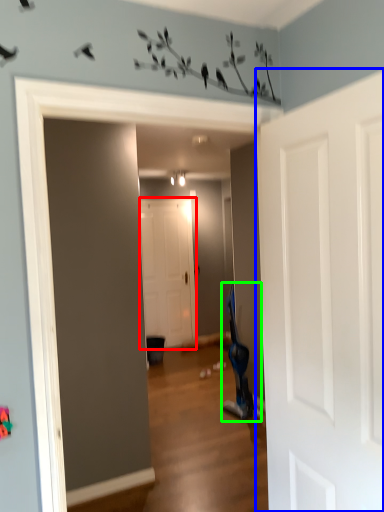
Question: Estimate the real-world distances between objects in this image. Which object is farther from door (highlighted by a red box), door (highlighted by a blue box) or swivel chair (highlighted by a green box)?

Choices:
 (A) door
 (B) swivel chair

Answer: (A)